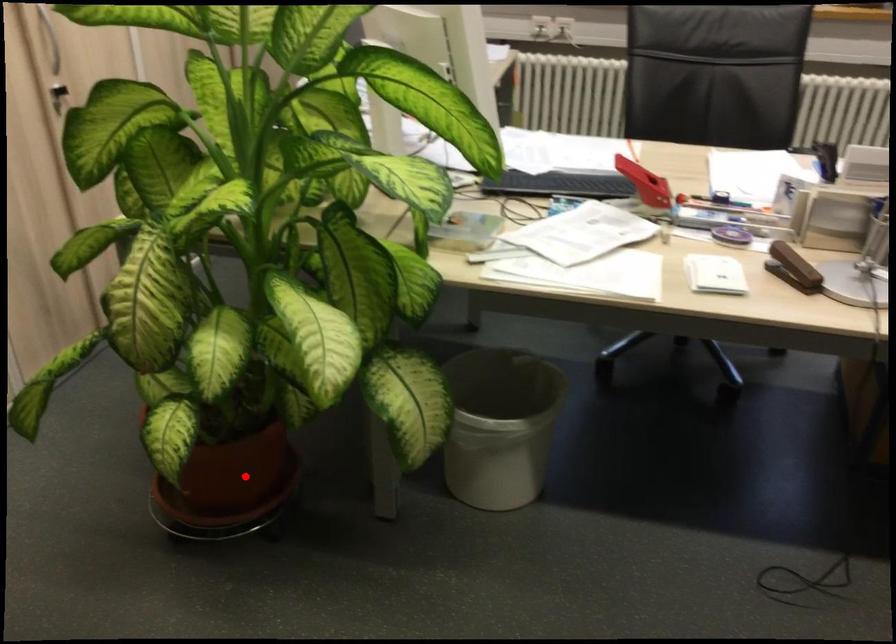
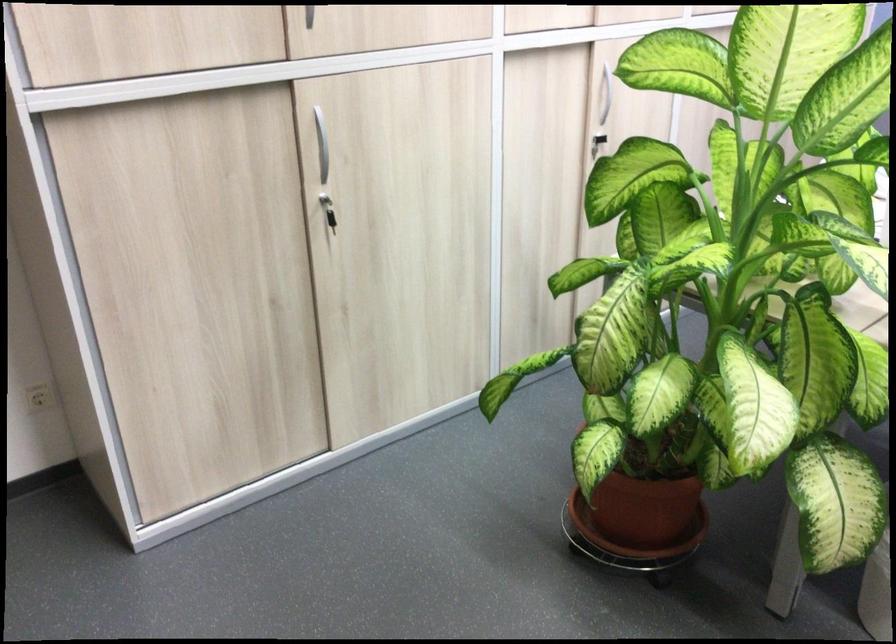
Question: I am providing you with two images of the same scene from different viewpoints. A red point is marked on the first image. Is the red point's position out of view in image 2?

Choices:
 (A) Yes
 (B) No

Answer: (B)